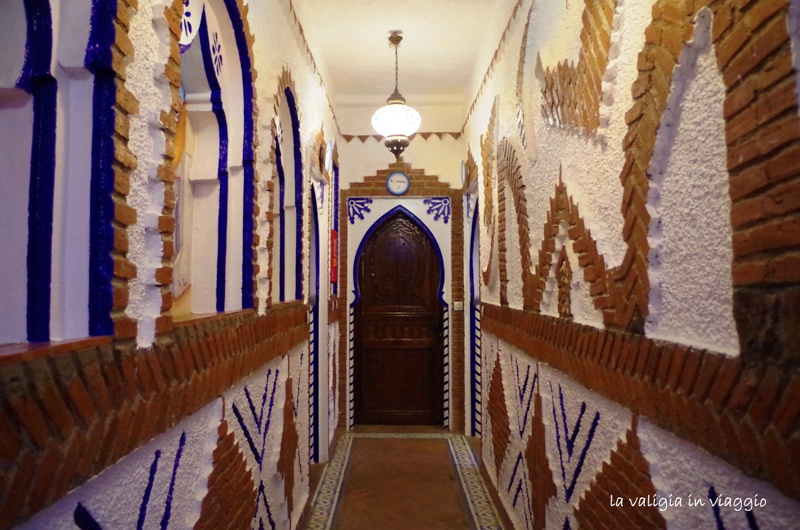
Where is `tile border`? The width and height of the screenshot is (800, 530). tile border is located at coordinates (477, 491), (460, 440), (342, 456), (332, 491).